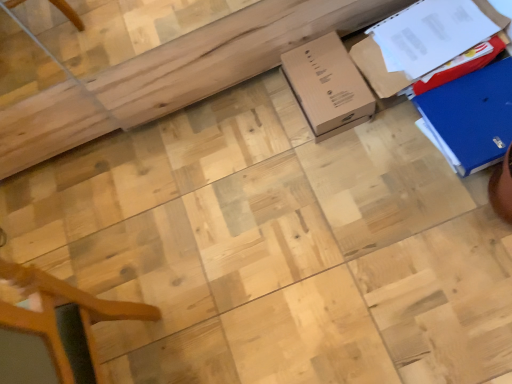
Question: Which direction should I rotate to look at brown cardboard box at center, the 1th cardboard box positioned from the left?

Choices:
 (A) left
 (B) right

Answer: (B)

Question: Can you confirm if brown cardboard box at upper right, which is the second cardboard box in left-to-right order, is wider than brown cardboard box at center, which appears as the 3th cardboard box when viewed from the right?

Choices:
 (A) no
 (B) yes

Answer: (B)

Question: Is brown cardboard box at upper right, the second cardboard box in the right-to-left sequence, completely or partially outside of brown cardboard box at center, the 1th cardboard box positioned from the left?

Choices:
 (A) yes
 (B) no

Answer: (A)

Question: Is brown cardboard box at upper right, the second cardboard box in the right-to-left sequence, bigger than brown cardboard box at center, the 1th cardboard box positioned from the left?

Choices:
 (A) yes
 (B) no

Answer: (A)

Question: Considering the relative sizes of brown cardboard box at upper right, the second cardboard box in the right-to-left sequence, and brown cardboard box at center, which appears as the 3th cardboard box when viewed from the right, in the image provided, is brown cardboard box at upper right, the second cardboard box in the right-to-left sequence, thinner than brown cardboard box at center, which appears as the 3th cardboard box when viewed from the right,?

Choices:
 (A) no
 (B) yes

Answer: (A)

Question: Considering the relative sizes of brown cardboard box at upper right, the second cardboard box in the right-to-left sequence, and brown cardboard box at center, the 1th cardboard box positioned from the left, in the image provided, is brown cardboard box at upper right, the second cardboard box in the right-to-left sequence, taller than brown cardboard box at center, the 1th cardboard box positioned from the left,?

Choices:
 (A) yes
 (B) no

Answer: (A)

Question: Is brown cardboard box at upper right, which is the second cardboard box in left-to-right order, in front of brown cardboard box at center, which appears as the 3th cardboard box when viewed from the right?

Choices:
 (A) yes
 (B) no

Answer: (A)

Question: Is blue cardboard box at right, the third cardboard box viewed from the left, smaller than brown cardboard box at center, which appears as the 3th cardboard box when viewed from the right?

Choices:
 (A) yes
 (B) no

Answer: (B)

Question: Does blue cardboard box at right, the third cardboard box viewed from the left, turn towards brown cardboard box at center, which appears as the 3th cardboard box when viewed from the right?

Choices:
 (A) no
 (B) yes

Answer: (A)

Question: Is blue cardboard box at right, which is the first cardboard box from right to left, at the right side of brown cardboard box at center, which appears as the 3th cardboard box when viewed from the right?

Choices:
 (A) yes
 (B) no

Answer: (A)

Question: From a real-world perspective, does blue cardboard box at right, the third cardboard box viewed from the left, stand above brown cardboard box at center, the 1th cardboard box positioned from the left?

Choices:
 (A) no
 (B) yes

Answer: (B)

Question: Does blue cardboard box at right, the third cardboard box viewed from the left, come behind brown cardboard box at center, the 1th cardboard box positioned from the left?

Choices:
 (A) yes
 (B) no

Answer: (B)

Question: Considering the relative sizes of blue cardboard box at right, the third cardboard box viewed from the left, and brown cardboard box at center, which appears as the 3th cardboard box when viewed from the right, in the image provided, is blue cardboard box at right, the third cardboard box viewed from the left, bigger than brown cardboard box at center, which appears as the 3th cardboard box when viewed from the right,?

Choices:
 (A) no
 (B) yes

Answer: (B)

Question: Can you confirm if brown cardboard box at center, which appears as the 3th cardboard box when viewed from the right, is shorter than brown cardboard box at upper right, the second cardboard box in the right-to-left sequence?

Choices:
 (A) no
 (B) yes

Answer: (B)